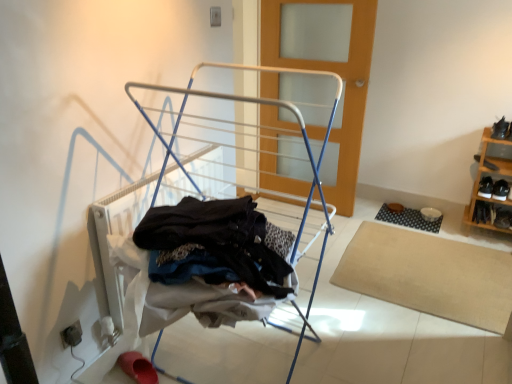
Question: Does black rubber mat at lower right, which is counted as the 1th mat, starting from the back, have a smaller size compared to black leather shoe at right, acting as the fourth shoe starting from the bottom?

Choices:
 (A) no
 (B) yes

Answer: (A)

Question: From the image's perspective, does black rubber mat at lower right, the first mat when ordered from top to bottom, appear lower than black leather shoe at right, arranged as the second shoe when viewed from the top?

Choices:
 (A) no
 (B) yes

Answer: (B)

Question: Is black leather shoe at right, acting as the fourth shoe starting from the bottom, completely or partially inside black rubber mat at lower right, which is counted as the 2th mat, starting from the bottom?

Choices:
 (A) no
 (B) yes

Answer: (A)

Question: Does black rubber mat at lower right, the first mat when ordered from top to bottom, have a larger size compared to black leather shoe at right, arranged as the second shoe when viewed from the top?

Choices:
 (A) yes
 (B) no

Answer: (A)

Question: From a real-world perspective, is black rubber mat at lower right, which is counted as the 1th mat, starting from the back, positioned over black leather shoe at right, acting as the fourth shoe starting from the bottom, based on gravity?

Choices:
 (A) yes
 (B) no

Answer: (B)

Question: In terms of width, does black leather shoes at lower right, which is counted as the first footwear, starting from the right, look wider or thinner when compared to black leather shoe at lower right, positioned as the 1th shoe in bottom-to-top order?

Choices:
 (A) thin
 (B) wide

Answer: (B)

Question: In the image, is black leather shoes at lower right, the 2th footwear ordered from the bottom, positioned in front of or behind black leather shoe at lower right, the 5th shoe in the top-to-bottom sequence?

Choices:
 (A) front
 (B) behind

Answer: (A)

Question: In the image, is black leather shoes at lower right, placed as the second footwear when sorted from left to right, on the left side or the right side of black leather shoe at lower right, positioned as the 1th shoe in bottom-to-top order?

Choices:
 (A) right
 (B) left

Answer: (B)

Question: From a real-world perspective, relative to black leather shoe at lower right, the 5th shoe in the top-to-bottom sequence, is black leather shoes at lower right, placed as the second footwear when sorted from left to right, vertically above or below?

Choices:
 (A) above
 (B) below

Answer: (A)

Question: Does point (478, 157) appear closer or farther from the camera than point (498, 211)?

Choices:
 (A) farther
 (B) closer

Answer: (A)

Question: Visually, is black leather shoe at right, acting as the fourth shoe starting from the bottom, positioned to the left or to the right of black leather shoe at lower right, positioned as the 1th shoe in bottom-to-top order?

Choices:
 (A) right
 (B) left

Answer: (B)

Question: From the image's perspective, is black leather shoe at right, arranged as the second shoe when viewed from the top, above or below black leather shoe at lower right, positioned as the 1th shoe in bottom-to-top order?

Choices:
 (A) above
 (B) below

Answer: (A)

Question: From a real-world perspective, is black leather shoe at right, acting as the fourth shoe starting from the bottom, positioned above or below black leather shoe at lower right, positioned as the 1th shoe in bottom-to-top order?

Choices:
 (A) above
 (B) below

Answer: (A)

Question: Considering the relative positions of wooden shoe rack at right and white metal drying rack at center in the image provided, is wooden shoe rack at right to the left or to the right of white metal drying rack at center?

Choices:
 (A) right
 (B) left

Answer: (A)

Question: In terms of width, does wooden shoe rack at right look wider or thinner when compared to white metal drying rack at center?

Choices:
 (A) thin
 (B) wide

Answer: (A)